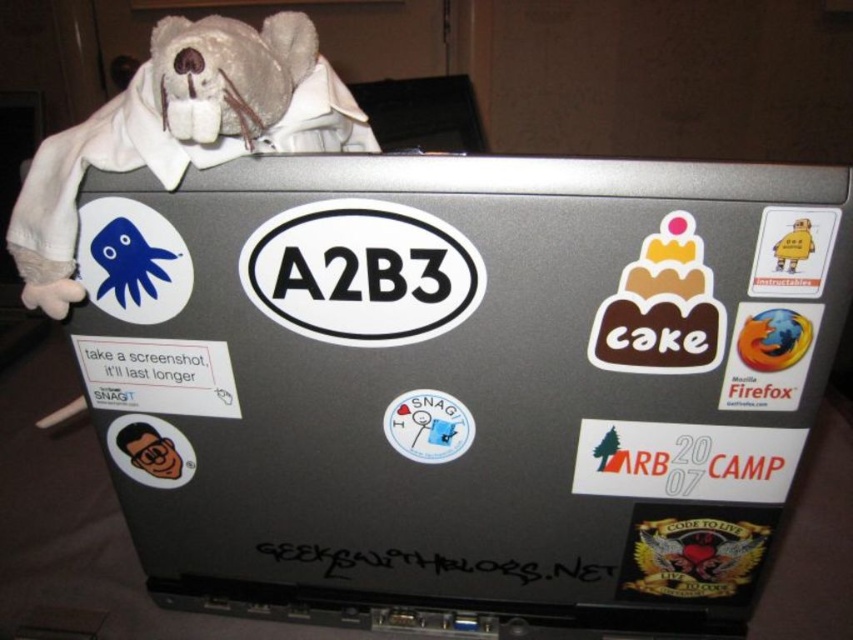
Question: Based on their relative distances, which object is nearer to the matte plastic face at lower left?

Choices:
 (A) metallic silver laptop at center
 (B) fuzzy fabric stuffed bear at upper left

Answer: (B)

Question: Which object is farther from the camera taking this photo?

Choices:
 (A) firefox sticker at right
 (B) white paper sticker at center

Answer: (B)

Question: Is white paper sticker at center further to camera compared to matte plastic face at lower left?

Choices:
 (A) no
 (B) yes

Answer: (A)

Question: Does yellow paper man at upper right have a larger size compared to matte plastic face at lower left?

Choices:
 (A) no
 (B) yes

Answer: (A)

Question: Which of the following is the closest to the observer?

Choices:
 (A) (624, 497)
 (B) (404, 394)
 (C) (134, 253)

Answer: (C)

Question: Is metallic silver laptop at center positioned in front of fuzzy fabric stuffed bear at upper left?

Choices:
 (A) no
 (B) yes

Answer: (A)